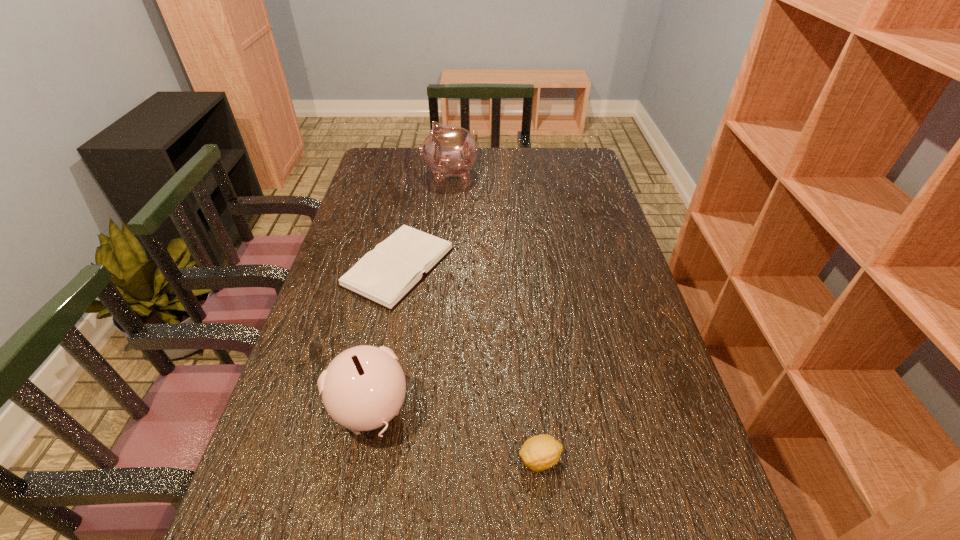
Locate an element on the screen. blank region between the nearer piggy bank and the lemon is located at coordinates (455, 435).

Identify the location of free spot between the tallest object and the second farthest object. This screenshot has width=960, height=540. (424, 220).

Identify the location of empty space between the taller piggy bank and the shortest object. (424, 220).

Image resolution: width=960 pixels, height=540 pixels. I want to click on the closest object to the farthest object, so click(x=385, y=275).

At what (x,y) coordinates should I click in order to perform the action: click on object that is the closest to the second farthest object. Please return your answer as a coordinate pair (x, y). This screenshot has width=960, height=540. Looking at the image, I should click on (363, 388).

Identify the location of free space that satisfies the following two spatial constraints: 1. on the front side of the third nearest object; 2. on the left side of the shorter piggy bank. (370, 410).